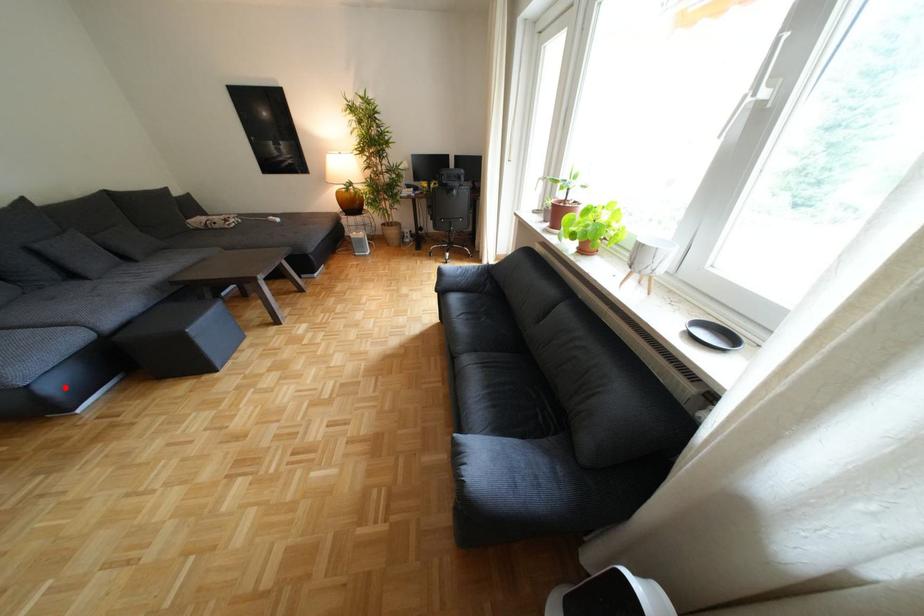
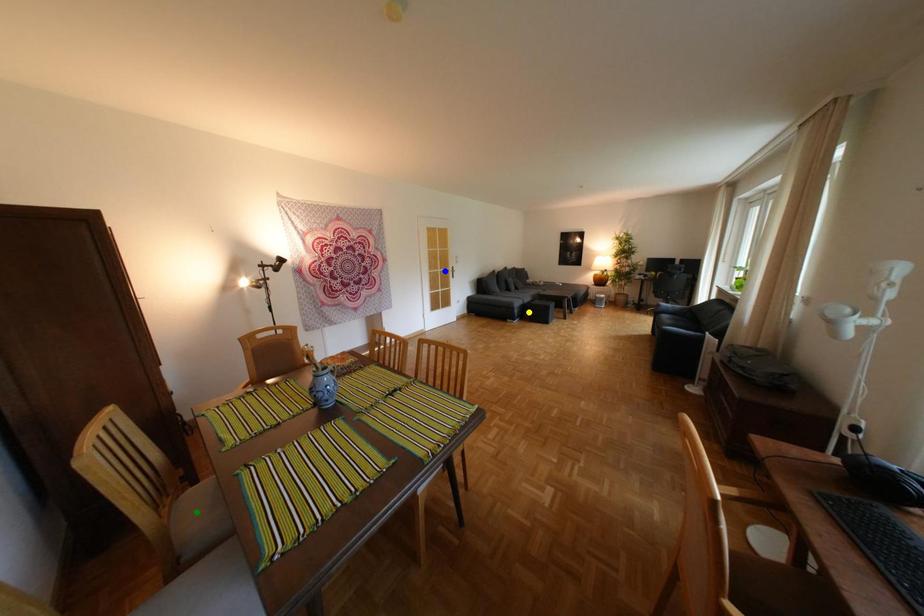
Question: I am providing you with two images of the same scene from different viewpoints. A red point is marked on the first image. You are given multiple points on the second image. Which spot in image 2 lines up with the point in image 1?

Choices:
 (A) yellow point
 (B) green point
 (C) blue point

Answer: (A)